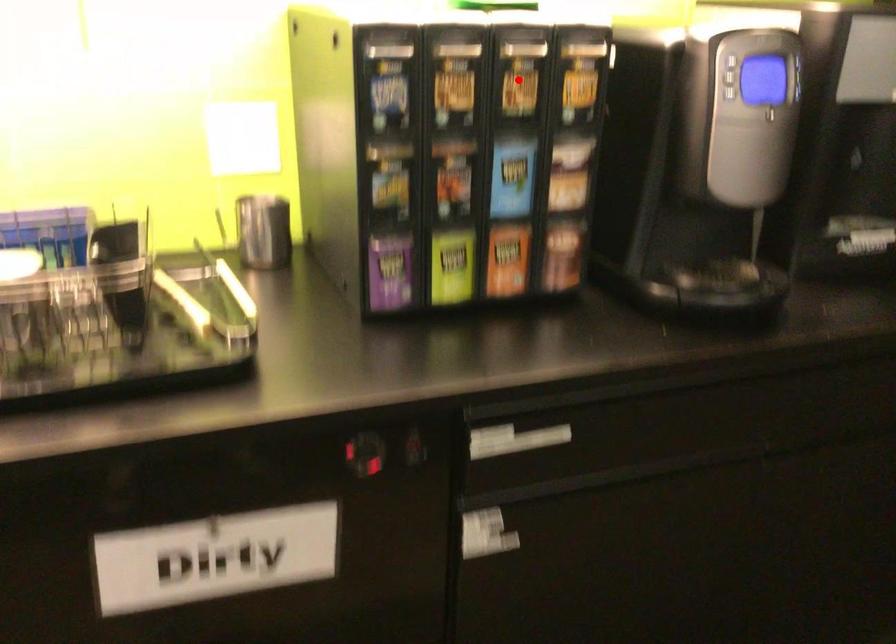
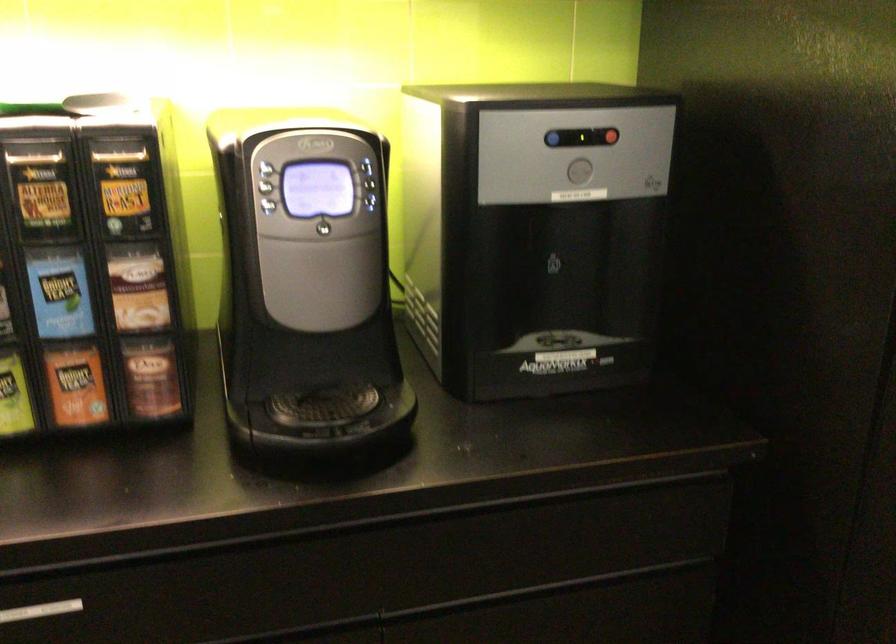
Question: I am providing you with two images of the same scene from different viewpoints. In image1, a red point is highlighted. Considering the same 3D point in image2, which of the following is correct?

Choices:
 (A) It is closer
 (B) It is farther

Answer: (A)